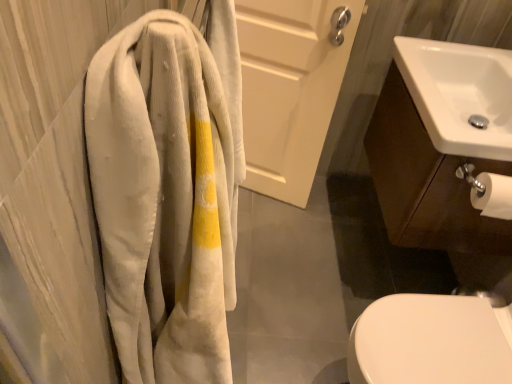
Question: Considering the relative positions of white matte door at upper center and white glossy sink at right in the image provided, is white matte door at upper center to the left of white glossy sink at right from the viewer's perspective?

Choices:
 (A) no
 (B) yes

Answer: (B)

Question: Is white matte door at upper center positioned with its back to white glossy sink at right?

Choices:
 (A) no
 (B) yes

Answer: (A)

Question: From the image's perspective, is white matte door at upper center below white glossy sink at right?

Choices:
 (A) no
 (B) yes

Answer: (A)

Question: Is white matte door at upper center directly adjacent to white glossy sink at right?

Choices:
 (A) no
 (B) yes

Answer: (A)

Question: Is white matte door at upper center shorter than white glossy sink at right?

Choices:
 (A) no
 (B) yes

Answer: (A)

Question: From their relative heights in the image, would you say corduroy towel at left is taller or shorter than white matte door at upper center?

Choices:
 (A) tall
 (B) short

Answer: (B)

Question: Considering their positions, is corduroy towel at left located in front of or behind white matte door at upper center?

Choices:
 (A) front
 (B) behind

Answer: (A)

Question: Looking at their shapes, would you say corduroy towel at left is wider or thinner than white matte door at upper center?

Choices:
 (A) wide
 (B) thin

Answer: (A)

Question: From the image's perspective, is corduroy towel at left located above or below white matte door at upper center?

Choices:
 (A) below
 (B) above

Answer: (A)

Question: Is white matte door at upper center taller or shorter than white glossy sink at upper right?

Choices:
 (A) short
 (B) tall

Answer: (B)

Question: Visually, is white matte door at upper center positioned to the left or to the right of white glossy sink at upper right?

Choices:
 (A) left
 (B) right

Answer: (A)

Question: Looking at the image, does white matte door at upper center seem bigger or smaller compared to white glossy sink at upper right?

Choices:
 (A) big
 (B) small

Answer: (A)

Question: Considering the positions of point (266, 104) and point (495, 81), is point (266, 104) closer or farther from the camera than point (495, 81)?

Choices:
 (A) closer
 (B) farther

Answer: (B)

Question: Which is correct: white glossy sink at upper right is inside white matte door at upper center, or outside of it?

Choices:
 (A) inside
 (B) outside

Answer: (B)

Question: Considering their positions, is white glossy sink at upper right located in front of or behind white matte door at upper center?

Choices:
 (A) behind
 (B) front

Answer: (B)